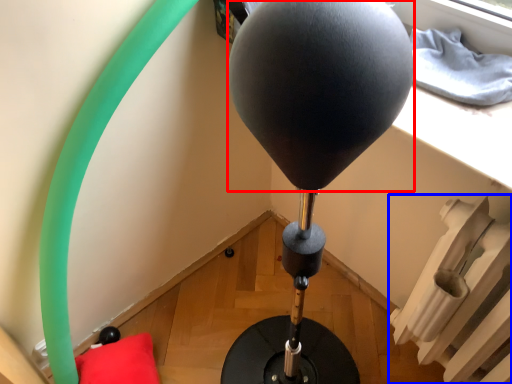
Question: Which object is closer to the camera taking this photo, balloon (highlighted by a red box) or radiator (highlighted by a blue box)?

Choices:
 (A) balloon
 (B) radiator

Answer: (B)